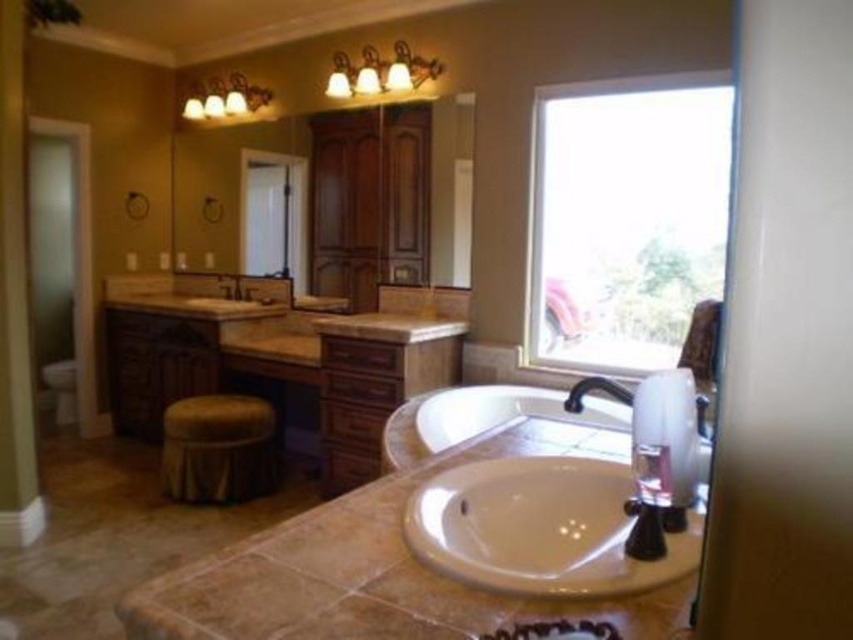
Is black rubber faucet at sink right wider than matte brown faucet at center?

No.

Measure the distance between black rubber faucet at sink right and matte brown faucet at center.

black rubber faucet at sink right is 3.45 meters away from matte brown faucet at center.

In order to click on black rubber faucet at sink right in this screenshot , I will do `click(595, 388)`.

What are the coordinates of `black rubber faucet at sink right` in the screenshot? It's located at (595, 388).

How much distance is there between beige tile countertop at center and velvet brown stool at center?

They are 6.66 feet apart.

Who is positioned more to the left, beige tile countertop at center or velvet brown stool at center?

velvet brown stool at center

Who is more forward, [619,577] or [228,454]?

Point [619,577] is in front.

You are a GUI agent. You are given a task and a screenshot of the screen. Output one action in this format:
    pyautogui.click(x=<x>, y=<y>)
    Task: Click on the beige tile countertop at center
    The height and width of the screenshot is (640, 853).
    Given the screenshot: What is the action you would take?
    pyautogui.click(x=410, y=561)

Is white glossy sink at center to the right of matte brown faucet at center from the viewer's perspective?

Indeed, white glossy sink at center is positioned on the right side of matte brown faucet at center.

Where is `white glossy sink at center`? white glossy sink at center is located at coordinates (x=538, y=528).

Image resolution: width=853 pixels, height=640 pixels. I want to click on white glossy sink at center, so click(x=538, y=528).

Locate an element on the screen. The height and width of the screenshot is (640, 853). white glossy sink at center is located at coordinates (538, 528).